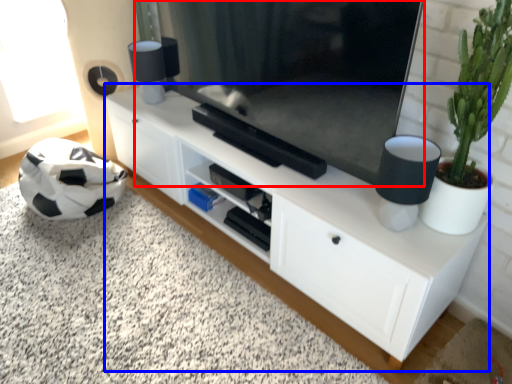
Question: Which object is further to the camera taking this photo, television (highlighted by a red box) or cabinetry (highlighted by a blue box)?

Choices:
 (A) television
 (B) cabinetry

Answer: (B)